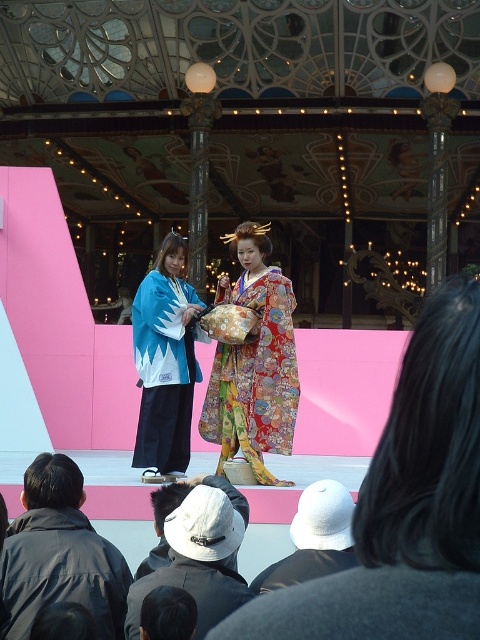
You are a photographer positioned at the back of the stage. You need to capture a photo that includes both the floral silk kimono at center and the white cotton hat at lower center. Which object should you focus on first to ensure both are in frame?

You should focus on the floral silk kimono at center first because it is closer to you than the white cotton hat at lower center, so adjusting the camera to include it will also capture the hat behind it.

You are an audience member sitting in the front row of the stage. You see the dark gray jacket at lower left and the blue and white kimono at center. Which one is positioned more to your left side?

The dark gray jacket at lower left is positioned more to the left side than the blue and white kimono at center.

You are an audience member sitting in the front row of the stage. You notice two hats at the lower center of the stage. Which one is positioned lower between the white fabric hat at lower center and the white cotton hat at lower center?

The white fabric hat at lower center is positioned lower than the white cotton hat at lower center as it is located below it.